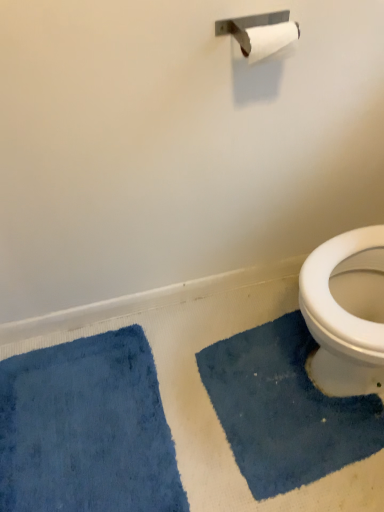
Find the location of a particular element. The width and height of the screenshot is (384, 512). blank space above blue plush bath mat at lower left, which appears as the 2th bath mat when viewed from the right (from a real-world perspective) is located at coordinates (71, 406).